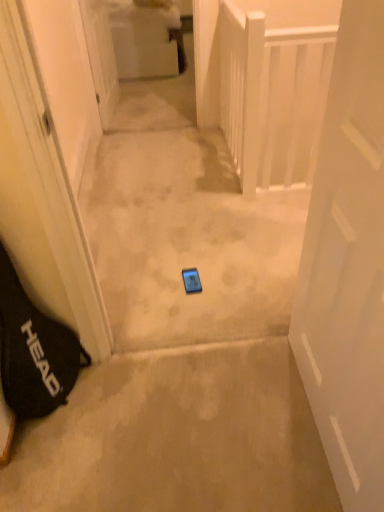
Question: Considering the positions of beige carpet at center and white wooden balustrade at upper right in the image, is beige carpet at center taller or shorter than white wooden balustrade at upper right?

Choices:
 (A) short
 (B) tall

Answer: (A)

Question: Based on their sizes in the image, would you say beige carpet at center is bigger or smaller than white wooden balustrade at upper right?

Choices:
 (A) big
 (B) small

Answer: (A)

Question: Which object is positioned closest to the white wooden balustrade at upper right?

Choices:
 (A) black fabric bag at left
 (B) beige carpet at center
 (C) blue glossy phone at center
 (D) white matte door at center, the 1th door in the front-to-back sequence
 (E) white glossy door at upper center, the first door from the back

Answer: (C)

Question: Which of these objects is positioned closest to the white glossy door at upper center, the 1th door viewed from the top?

Choices:
 (A) white wooden balustrade at upper right
 (B) blue glossy phone at center
 (C) black fabric bag at left
 (D) white matte door at center, the first door ordered from the bottom
 (E) beige carpet at center

Answer: (B)